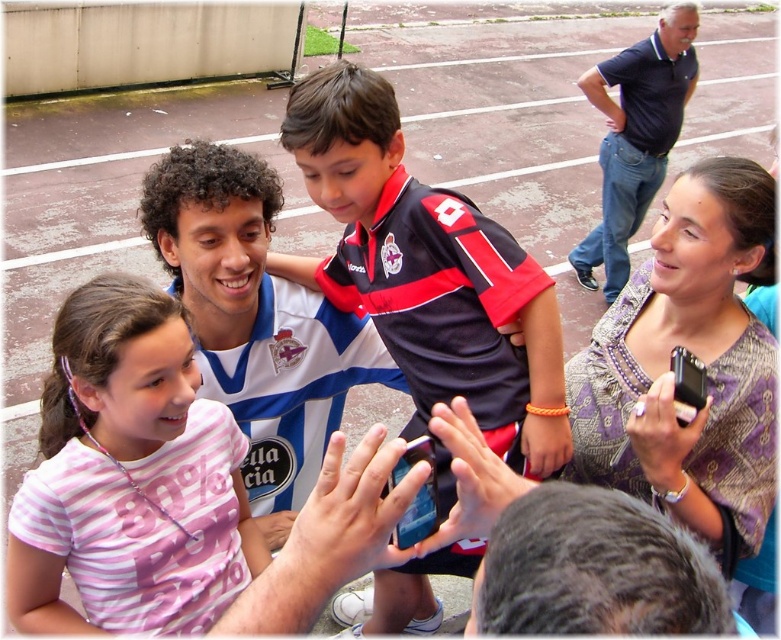
Based on the photo, you are a photographer at the event and want to capture a photo that includes both the pink striped shirt at center and the dark blue polo shirt at upper right. Based on their positions, which shirt should be placed on the left side of the photo?

The pink striped shirt at center should be placed on the left side of the photo because it is already positioned to the left of the dark blue polo shirt at upper right in the scene.